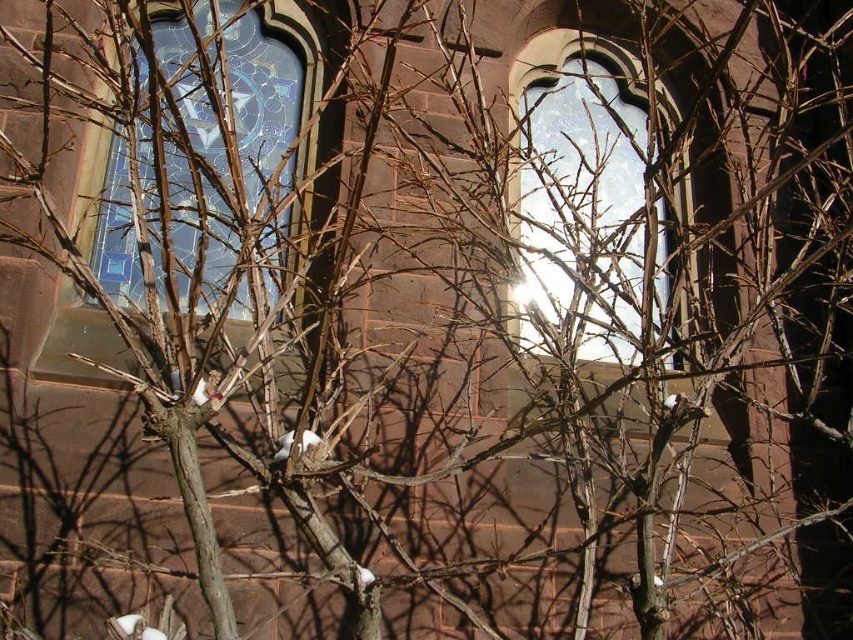
Which is below, clear glass window at center or stained glass window at upper left?

clear glass window at center

Between point (541, 152) and point (209, 148), which one is positioned behind?

The point (541, 152) is behind.

Is point (625, 314) behind point (225, 49)?

No.

In order to click on clear glass window at center in this screenshot , I will do `click(585, 198)`.